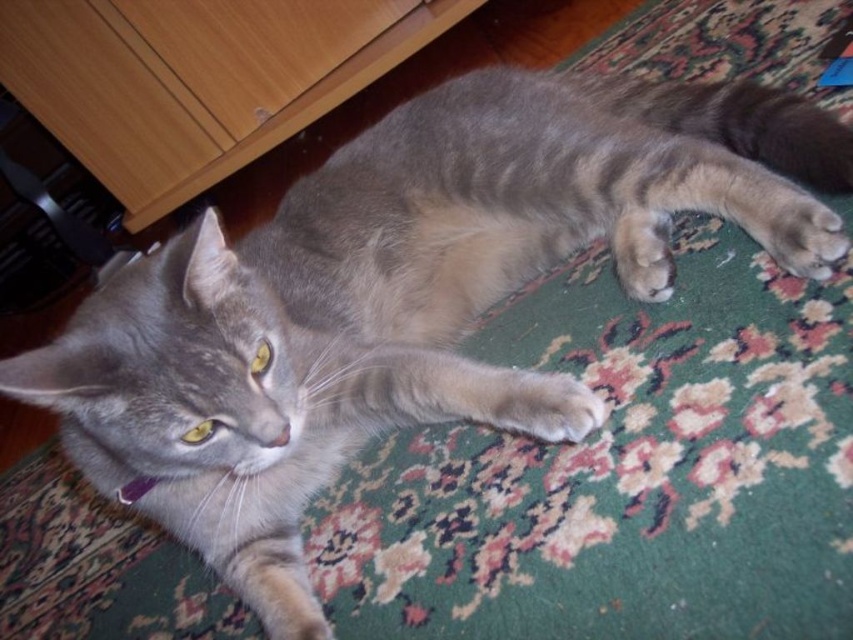
Who is more forward, (534, 426) or (772, 234)?

Point (534, 426) is in front.

Between point (544, 429) and point (799, 243), which one is positioned behind?

The point (799, 243) is more distant.

The width and height of the screenshot is (853, 640). Identify the location of gray fur paw at center. (546, 404).

In the scene shown: Can you confirm if gray fur paw at center is positioned to the left of soft fur paw at center?

Correct, you'll find gray fur paw at center to the left of soft fur paw at center.

The image size is (853, 640). What do you see at coordinates (546, 404) in the screenshot? I see `gray fur paw at center` at bounding box center [546, 404].

At what (x,y) coordinates should I click in order to perform the action: click on gray fur paw at center. Please return your answer as a coordinate pair (x, y). Image resolution: width=853 pixels, height=640 pixels. Looking at the image, I should click on (546, 404).

Is point (764, 218) farther from viewer compared to point (651, 275)?

No, it is not.

Does point (802, 214) lie in front of point (611, 237)?

Yes.

Where is `gray fur paw at lower right`? Image resolution: width=853 pixels, height=640 pixels. gray fur paw at lower right is located at coordinates pos(804,234).